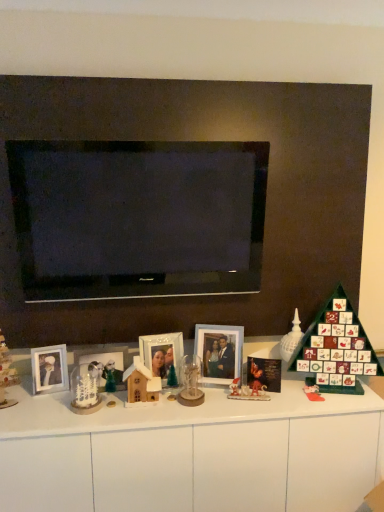
You are a GUI agent. You are given a task and a screenshot of the screen. Output one action in this format:
    pyautogui.click(x=<x>, y=<y>)
    Task: Click on the free location to the right of white frosted glass candle holder at lower left, positioned as the first candle holder in left-to-right order
    
    Given the screenshot: What is the action you would take?
    pyautogui.click(x=121, y=411)